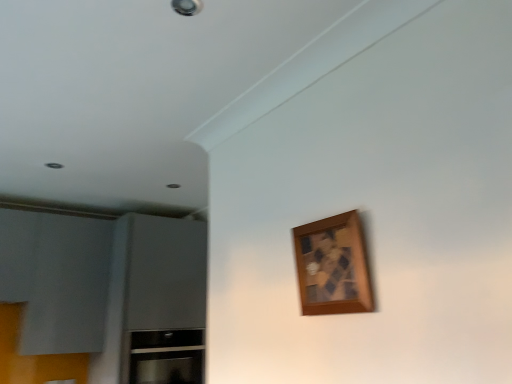
Question: Considering the positions of wooden picture frame at upper right and satin silver cabinet at lower left in the image, is wooden picture frame at upper right taller or shorter than satin silver cabinet at lower left?

Choices:
 (A) tall
 (B) short

Answer: (B)

Question: From a real-world perspective, relative to satin silver cabinet at lower left, is wooden picture frame at upper right vertically above or below?

Choices:
 (A) above
 (B) below

Answer: (A)

Question: In the image, is wooden picture frame at upper right on the left side or the right side of satin silver cabinet at lower left?

Choices:
 (A) left
 (B) right

Answer: (B)

Question: Considering the positions of satin silver cabinet at lower left and wooden picture frame at upper right in the image, is satin silver cabinet at lower left taller or shorter than wooden picture frame at upper right?

Choices:
 (A) short
 (B) tall

Answer: (B)

Question: Is satin silver cabinet at lower left in front of or behind wooden picture frame at upper right in the image?

Choices:
 (A) front
 (B) behind

Answer: (B)

Question: Which is correct: satin silver cabinet at lower left is inside wooden picture frame at upper right, or outside of it?

Choices:
 (A) inside
 (B) outside

Answer: (B)

Question: Based on their sizes in the image, would you say satin silver cabinet at lower left is bigger or smaller than wooden picture frame at upper right?

Choices:
 (A) small
 (B) big

Answer: (B)